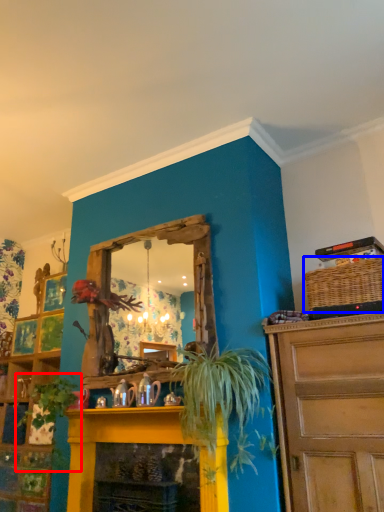
Question: Which point is closer to the camera, plant (highlighted by a red box) or basket (highlighted by a blue box)?

Choices:
 (A) plant
 (B) basket

Answer: (B)